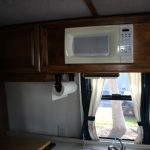
Find the location of `curtains`. curtains is located at coordinates (95, 102), (138, 100).